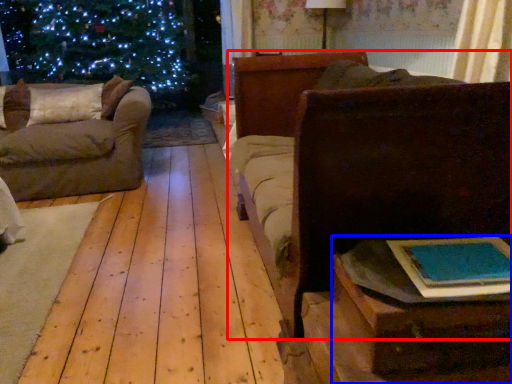
Question: Which object appears farthest to the camera in this image, furniture (highlighted by a red box) or table (highlighted by a blue box)?

Choices:
 (A) furniture
 (B) table

Answer: (A)